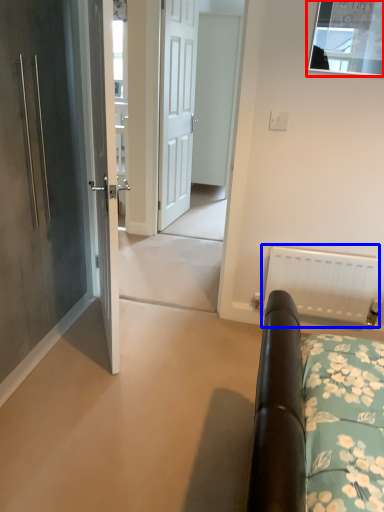
Question: Which object appears farthest to the camera in this image, window (highlighted by a red box) or radiator (highlighted by a blue box)?

Choices:
 (A) window
 (B) radiator

Answer: (B)